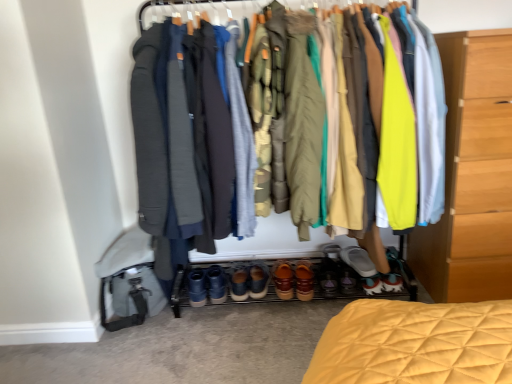
Question: Does point (349, 263) appear closer or farther from the camera than point (285, 269)?

Choices:
 (A) farther
 (B) closer

Answer: (A)

Question: In terms of height, does white fabric shoe at lower center, marked as the 6th footwear in a left-to-right arrangement, look taller or shorter compared to brown leather shoes at center, arranged as the 4th footwear when viewed from the right?

Choices:
 (A) tall
 (B) short

Answer: (B)

Question: Considering the real-world distances, which object is farthest from the leather suede shoes at center, placed as the sixth footwear when sorted from right to left?

Choices:
 (A) leather brown shoes at center, the second footwear positioned from the right
 (B) gray wool robe at center, positioned as the 3th robe in left-to-right order
 (C) light wood chest of drawers at right
 (D) dark gray fabric robe at center, the first robe in the left-to-right sequence
 (E) matte yellow jacket at right

Answer: (C)

Question: Which object is positioned farthest from the leather shoes at center, which ranks as the 4th footwear in left-to-right order?

Choices:
 (A) leather brown shoes at center, which is counted as the 5th footwear, starting from the left
 (B) textured fabric jackets at center
 (C) matte yellow jacket at right
 (D) brown suede shoes at center, placed as the 5th footwear when sorted from right to left
 (E) olive green cotton robe at center, the fourth robe from the left

Answer: (E)